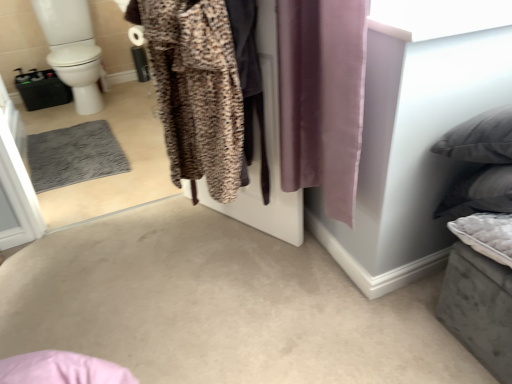
Question: Is leopard print fabric at center with white glossy toilet bowl at left?

Choices:
 (A) yes
 (B) no

Answer: (B)

Question: Is leopard print fabric at center at the right side of white glossy toilet bowl at left?

Choices:
 (A) yes
 (B) no

Answer: (A)

Question: Could you tell me if leopard print fabric at center is turned towards white glossy toilet bowl at left?

Choices:
 (A) no
 (B) yes

Answer: (A)

Question: Is leopard print fabric at center located outside white glossy toilet bowl at left?

Choices:
 (A) no
 (B) yes

Answer: (B)

Question: Is leopard print fabric at center behind white glossy toilet bowl at left?

Choices:
 (A) no
 (B) yes

Answer: (A)

Question: From a real-world perspective, is purple silky curtain at center physically located above or below brown textured robe at center?

Choices:
 (A) above
 (B) below

Answer: (A)

Question: Looking at their shapes, would you say purple silky curtain at center is wider or thinner than brown textured robe at center?

Choices:
 (A) wide
 (B) thin

Answer: (B)

Question: From their relative heights in the image, would you say purple silky curtain at center is taller or shorter than brown textured robe at center?

Choices:
 (A) tall
 (B) short

Answer: (B)

Question: Is point (340, 96) positioned closer to the camera than point (210, 99)?

Choices:
 (A) farther
 (B) closer

Answer: (B)

Question: From their relative heights in the image, would you say white glossy toilet bowl at left is taller or shorter than leopard print fabric at center?

Choices:
 (A) short
 (B) tall

Answer: (B)

Question: From a real-world perspective, is white glossy toilet bowl at left above or below leopard print fabric at center?

Choices:
 (A) above
 (B) below

Answer: (B)

Question: In terms of size, does white glossy toilet bowl at left appear bigger or smaller than leopard print fabric at center?

Choices:
 (A) big
 (B) small

Answer: (A)

Question: From the image's perspective, is white glossy toilet bowl at left located above or below leopard print fabric at center?

Choices:
 (A) above
 (B) below

Answer: (A)

Question: Visually, is brown textured robe at center positioned to the left or to the right of purple silky curtain at center?

Choices:
 (A) left
 (B) right

Answer: (A)

Question: From the image's perspective, relative to purple silky curtain at center, is brown textured robe at center above or below?

Choices:
 (A) below
 (B) above

Answer: (B)